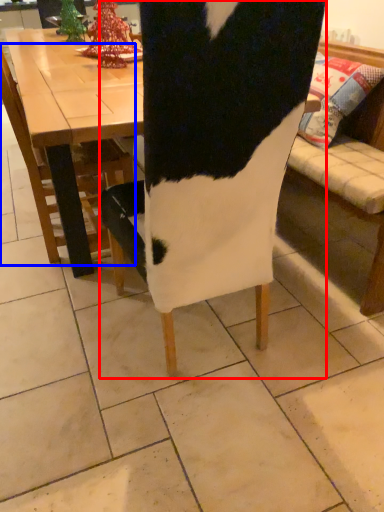
Question: Among these objects, which one is nearest to the camera, chair (highlighted by a red box) or chair (highlighted by a blue box)?

Choices:
 (A) chair
 (B) chair

Answer: (A)